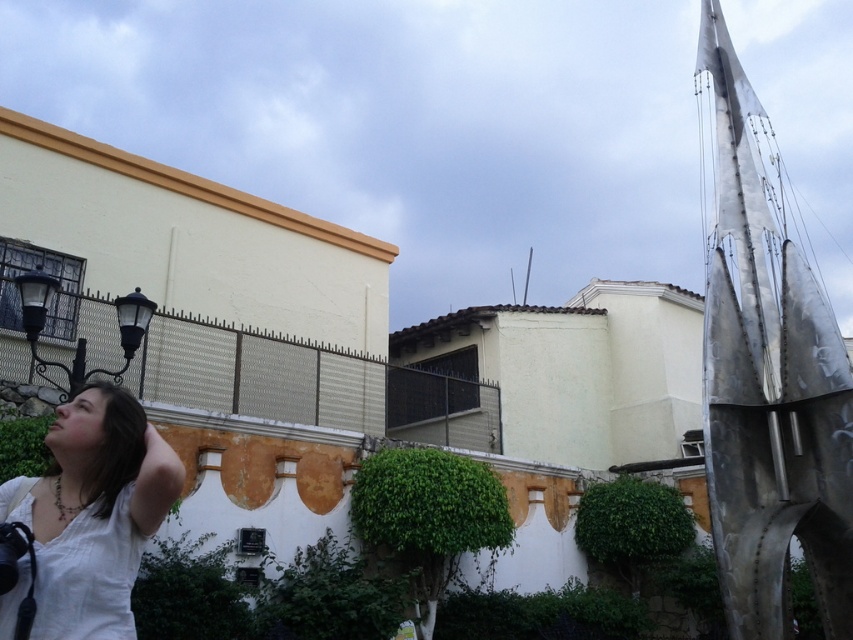
You are a photographer trying to capture a clear shot of the white cotton shirt at lower left without the metallic silver sculpture at right blocking it. Based on the scene, which direction should you move to ensure the sculpture is out of frame?

To avoid the metallic silver sculpture at right blocking the white cotton shirt at lower left, move to the left side since the sculpture is positioned to the right of the shirt.

From the picture: You are a photographer trying to capture a full view of both the metallic silver sculpture at right and the white cotton shirt at lower left in a single shot. Based on their sizes, which object might require you to adjust your camera angle to include its entire structure?

The metallic silver sculpture at right has a greater height compared to the white cotton shirt at lower left, so you might need to adjust your camera angle to include its entire structure.

You are a delivery drone with a wingspan of 1.5 meters. You need to fly from the metallic silver sculpture at right to the white cotton shirt at lower left. Is there enough space for you to pass through the gap between them?

The gap between the metallic silver sculpture at right and the white cotton shirt at lower left is 10.92 meters, which is significantly wider than the drone wingspan of 1.5 meters. Yes, the drone can safely pass through the gap.